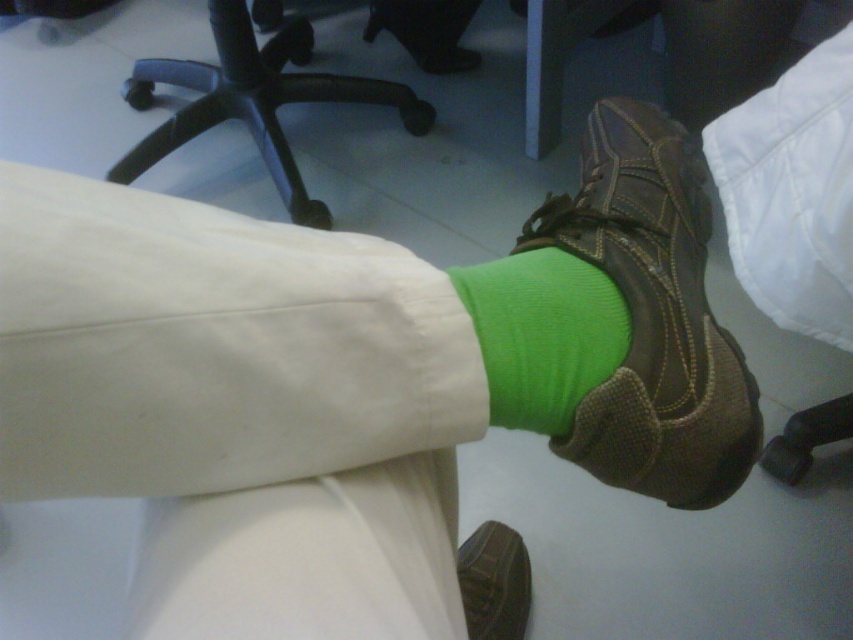
Question: Which of these objects is positioned closest to the brown leather shoe at lower center?

Choices:
 (A) black plastic swivel chair at upper center
 (B) green ribbed sock at center
 (C) brown leather shoe at center

Answer: (C)

Question: Is the position of green ribbed sock at center more distant than that of black plastic swivel chair at upper center?

Choices:
 (A) yes
 (B) no

Answer: (B)

Question: Which point is closer to the camera?

Choices:
 (A) (604, 472)
 (B) (248, 118)
 (C) (573, 369)
 (D) (489, 547)

Answer: (C)

Question: Is green ribbed sock at center to the left of brown leather shoe at lower center from the viewer's perspective?

Choices:
 (A) no
 (B) yes

Answer: (B)

Question: Which object appears farthest from the camera in this image?

Choices:
 (A) brown leather shoe at center
 (B) black plastic swivel chair at upper center
 (C) brown leather shoe at lower center
 (D) green ribbed sock at center

Answer: (B)

Question: Is green ribbed sock at center smaller than black plastic swivel chair at upper center?

Choices:
 (A) no
 (B) yes

Answer: (B)